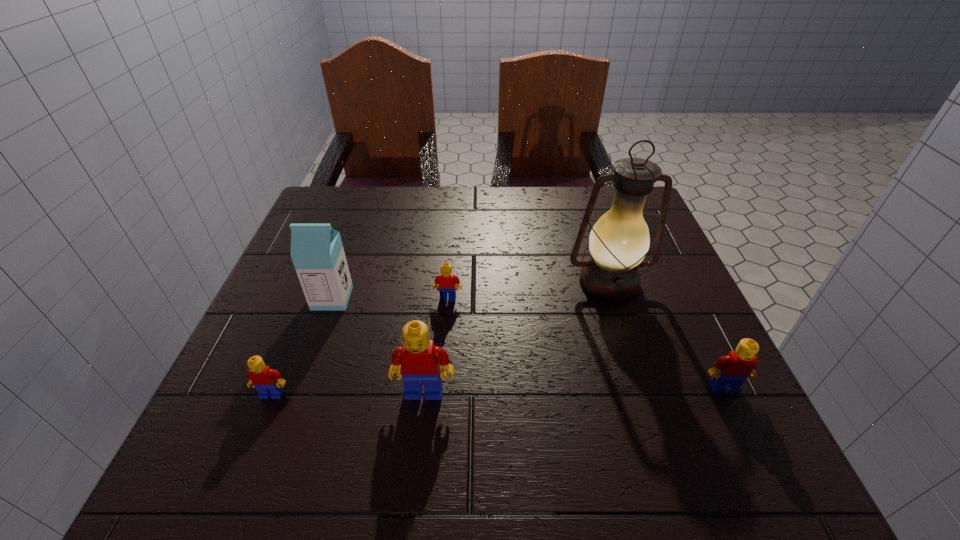
The height and width of the screenshot is (540, 960). I want to click on free space between the tallest Lego and the second tallest Lego, so click(x=574, y=390).

The height and width of the screenshot is (540, 960). I want to click on free spot between the leftmost Lego and the second object from right to left, so click(x=441, y=339).

Where is `free space between the milk carton and the farthest Lego`? free space between the milk carton and the farthest Lego is located at coordinates (390, 298).

This screenshot has width=960, height=540. What are the coordinates of `object identified as the second closest to the leftmost Lego` in the screenshot? It's located at (317, 252).

Locate which object ranks second in proximity to the farthest Lego. Please provide its 2D coordinates. Your answer should be formatted as a tuple, i.e. [(x, y)], where the tuple contains the x and y coordinates of a point satisfying the conditions above.

[(420, 360)]

Locate which Lego is the closest to the tallest Lego. Please provide its 2D coordinates. Your answer should be formatted as a tuple, i.e. [(x, y)], where the tuple contains the x and y coordinates of a point satisfying the conditions above.

[(267, 382)]

This screenshot has width=960, height=540. In order to click on Lego that is the closest one to the milk carton in this screenshot , I will do tap(447, 281).